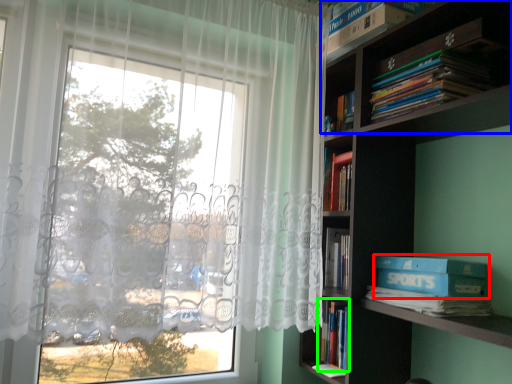
Question: Based on their relative distances, which object is farther from paperback book (highlighted by a red box)? Choose from shelf (highlighted by a blue box) and book (highlighted by a green box).

Choices:
 (A) shelf
 (B) book

Answer: (A)